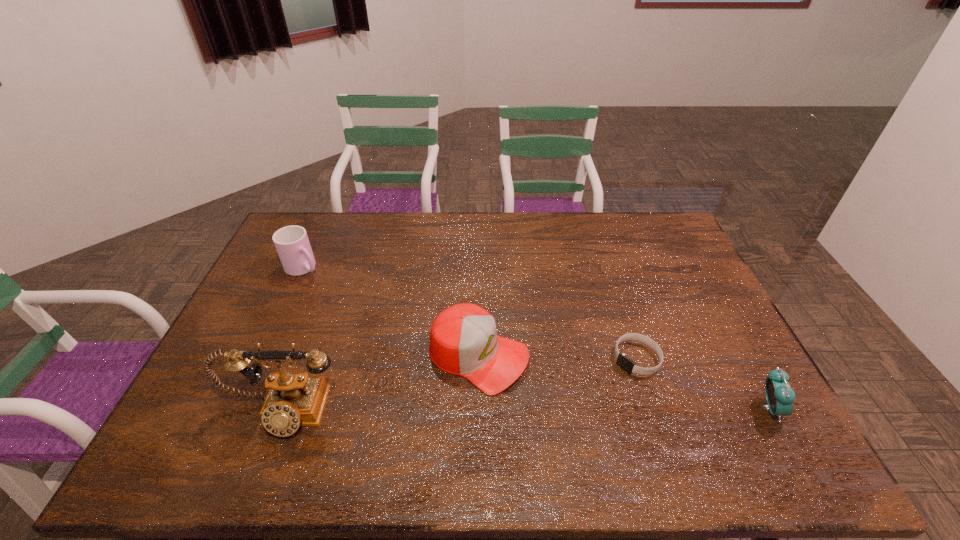
At what (x,y) coordinates should I click in order to perform the action: click on free space that satisfies the following two spatial constraints: 1. on the front side of the shortest object; 2. on the face of the alarm clock. Please return your answer as a coordinate pair (x, y). Looking at the image, I should click on (653, 408).

Find the location of `vacant space that satisfies the following two spatial constraints: 1. on the front side of the third object from right to left; 2. on the left side of the cup`. vacant space that satisfies the following two spatial constraints: 1. on the front side of the third object from right to left; 2. on the left side of the cup is located at coordinates (264, 355).